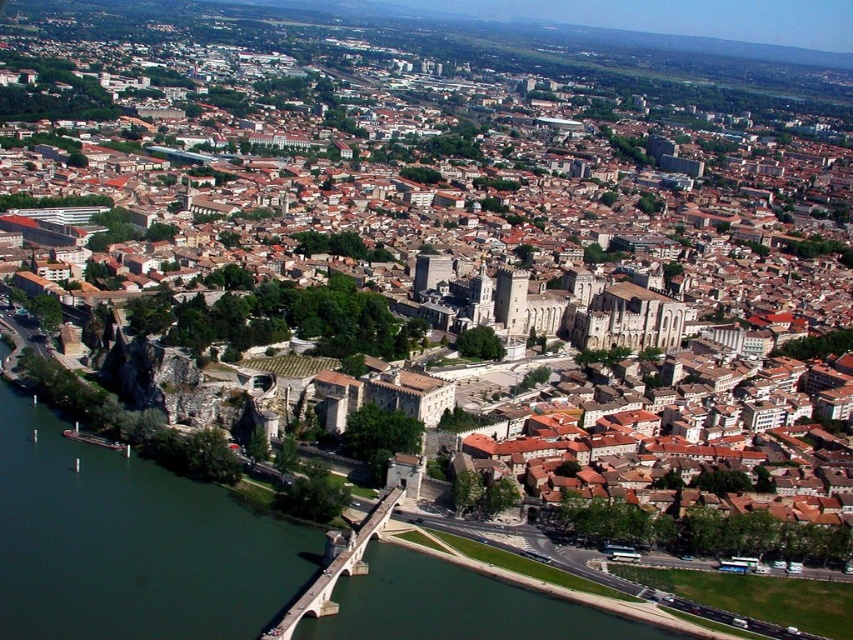
You are a drone operator flying over the city. You notice the green water at lower left and the stone bridge at lower center. Which object appears taller from your aerial view?

The green water at lower left appears taller than the stone bridge at lower center based on the perspective from the aerial view.